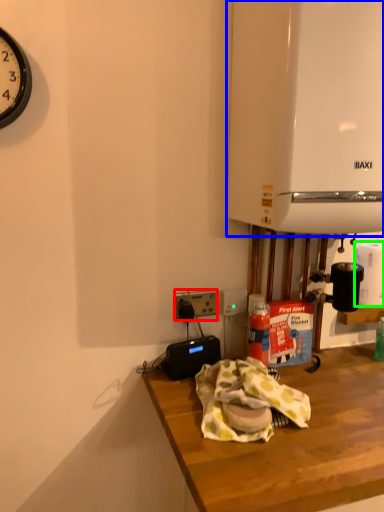
Question: Based on their relative distances, which object is nearer to power outlet (highlighted by a red box)? Choose from appliance (highlighted by a blue box) and paper towel (highlighted by a green box).

Choices:
 (A) appliance
 (B) paper towel

Answer: (B)